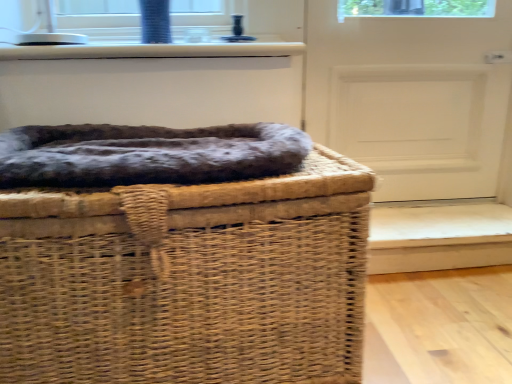
Question: Is woven brown basket at center in front of or behind white matte door at center in the image?

Choices:
 (A) behind
 (B) front

Answer: (B)

Question: From a real-world perspective, is woven brown basket at center positioned above or below white matte door at center?

Choices:
 (A) below
 (B) above

Answer: (A)

Question: Estimate the real-world distances between objects in this image. Which object is closer to the woven brown basket at center?

Choices:
 (A) white glossy window sill at upper center
 (B) white matte door at center
 (C) dark gray plush dog bed at center

Answer: (C)

Question: Estimate the real-world distances between objects in this image. Which object is farther from the dark gray plush dog bed at center?

Choices:
 (A) white glossy window sill at upper center
 (B) woven brown basket at center
 (C) white matte door at center

Answer: (C)